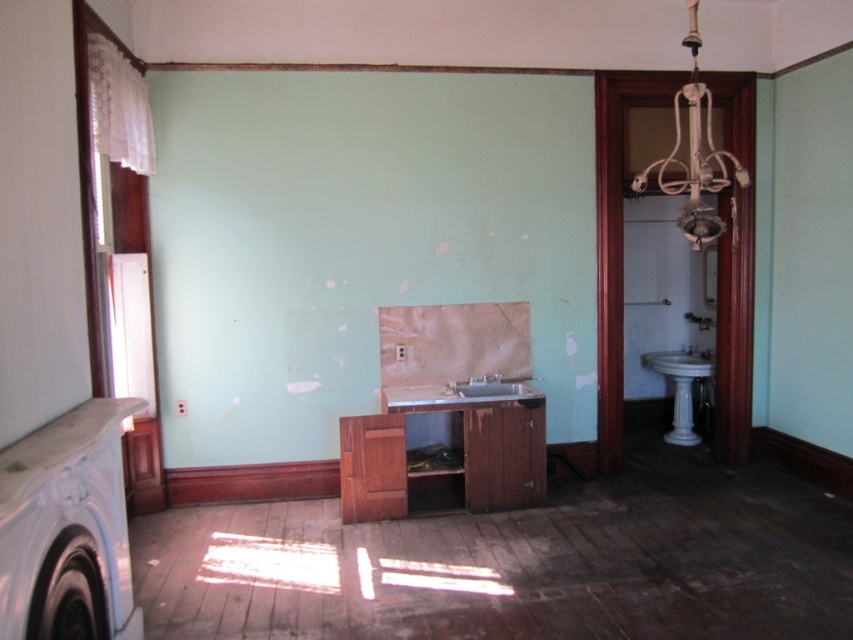
You are a contractor measuring distances in a bathroom. You need to ensure the white matte chandelier at upper right is at least 2.5 meters away from the camera to comply with safety regulations. Is the current distance compliant?

The white matte chandelier at upper right is 2.48 meters away from the camera, which is slightly less than the required 2.5 meters. Therefore, it does not comply with the safety regulations.

You are a contractor assessing the bathroom layout. You need to place a new decorative plant on the white marble pedestal at right. However, you want to ensure it won not block the view of the matte white sink at center from the entrance. Can you confirm if the pedestal is positioned in a way that allows the sink to be visible when the plant is placed?

The white marble pedestal at right is located below the matte white sink at center, so placing a plant on the pedestal would not block the view of the sink from the entrance as the sink is above it.